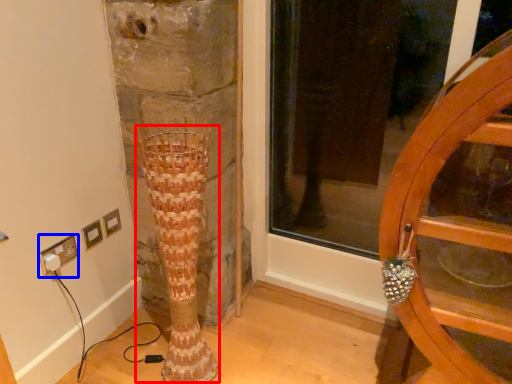
Question: Which point is further to the camera, tree trunk (highlighted by a red box) or electric outlet (highlighted by a blue box)?

Choices:
 (A) tree trunk
 (B) electric outlet

Answer: (B)